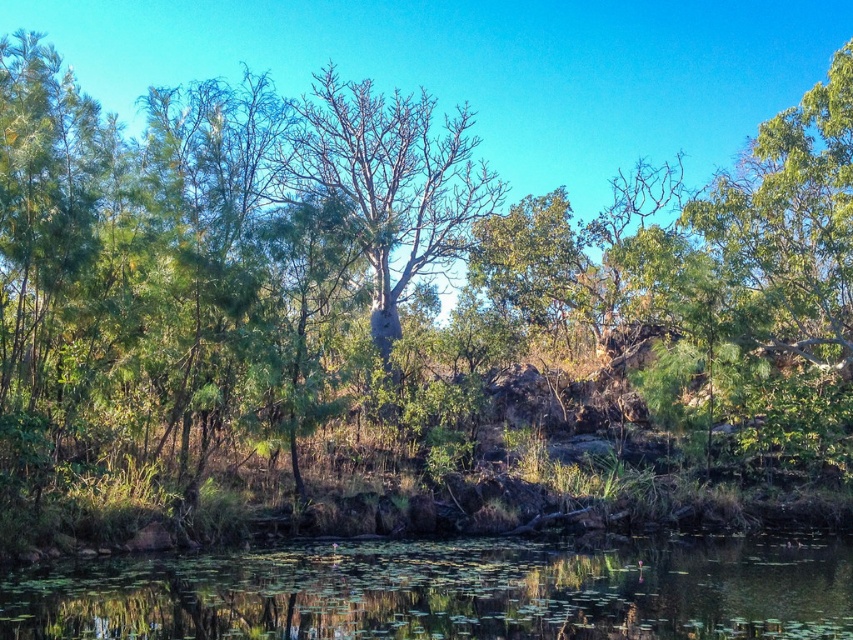
Can you confirm if green leafy water at lower center is wider than bare wood tree at center?

Yes.

Can you confirm if green leafy water at lower center is thinner than bare wood tree at center?

In fact, green leafy water at lower center might be wider than bare wood tree at center.

Describe the element at coordinates (448, 593) in the screenshot. I see `green leafy water at lower center` at that location.

In order to click on green leafy water at lower center in this screenshot , I will do `click(448, 593)`.